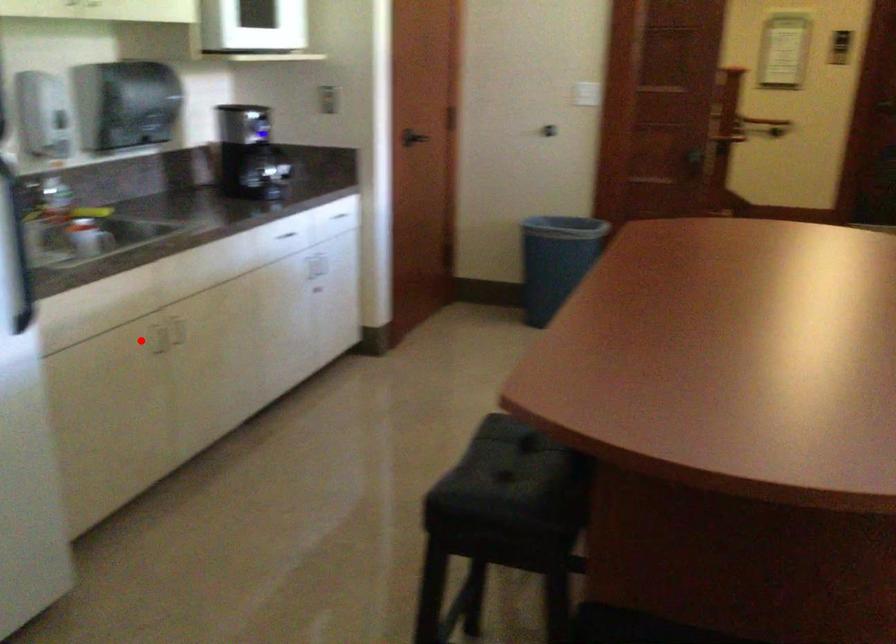
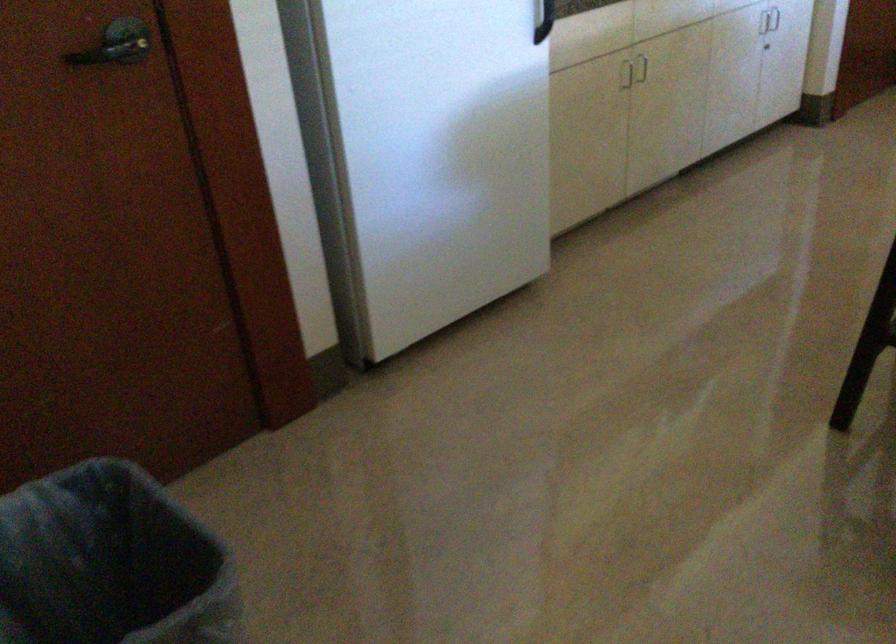
Question: I am providing you with two images of the same scene from different viewpoints. Image1 has a red point marked. In image2, the corresponding 3D location appears at what relative position? Reply with the corresponding letter.

Choices:
 (A) Closer
 (B) Farther

Answer: (B)